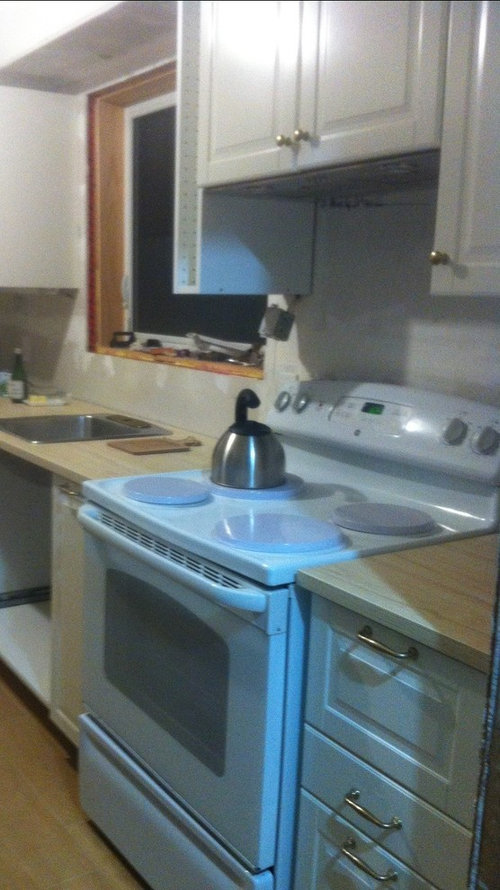
Find the location of `kettle`. kettle is located at coordinates (259, 460).